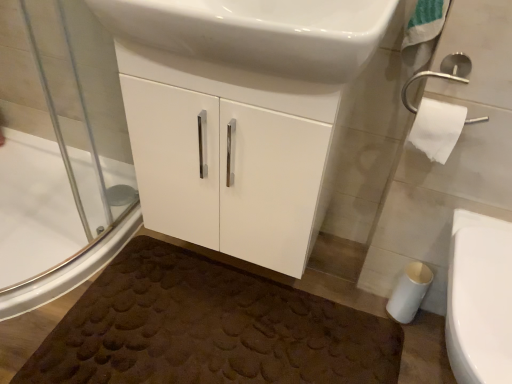
Question: Can you confirm if white glossy bidet at lower right is wider than white glossy sink at upper center?

Choices:
 (A) no
 (B) yes

Answer: (B)

Question: Can you confirm if white glossy bidet at lower right is shorter than white glossy sink at upper center?

Choices:
 (A) yes
 (B) no

Answer: (B)

Question: Is white glossy bidet at lower right facing away from white glossy sink at upper center?

Choices:
 (A) yes
 (B) no

Answer: (B)

Question: Is white glossy bidet at lower right surrounding white glossy sink at upper center?

Choices:
 (A) yes
 (B) no

Answer: (B)

Question: Can you confirm if white glossy bidet at lower right is positioned to the left of white glossy sink at upper center?

Choices:
 (A) yes
 (B) no

Answer: (B)

Question: Based on their positions, is white glossy sink at upper center located to the left or right of white glossy cabinet at center?

Choices:
 (A) right
 (B) left

Answer: (A)

Question: Considering the positions of white glossy sink at upper center and white glossy cabinet at center in the image, is white glossy sink at upper center taller or shorter than white glossy cabinet at center?

Choices:
 (A) short
 (B) tall

Answer: (A)

Question: Do you think white glossy sink at upper center is within white glossy cabinet at center, or outside of it?

Choices:
 (A) outside
 (B) inside

Answer: (A)

Question: Considering their positions, is white glossy sink at upper center located in front of or behind white glossy cabinet at center?

Choices:
 (A) behind
 (B) front

Answer: (B)

Question: Considering the positions of point pos(398,307) and point pos(389,342), is point pos(398,307) closer or farther from the camera than point pos(389,342)?

Choices:
 (A) farther
 (B) closer

Answer: (A)

Question: Looking at their shapes, would you say white matte toilet paper at lower right, the 2th toilet paper in the top-to-bottom sequence, is wider or thinner than brown textured bath mat at lower center?

Choices:
 (A) thin
 (B) wide

Answer: (A)

Question: Is white matte toilet paper at lower right, which is counted as the first toilet paper, starting from the back, in front of or behind brown textured bath mat at lower center in the image?

Choices:
 (A) front
 (B) behind

Answer: (B)

Question: From the image's perspective, is white matte toilet paper at lower right, arranged as the 2th toilet paper when viewed from the front, above or below brown textured bath mat at lower center?

Choices:
 (A) above
 (B) below

Answer: (A)

Question: From their relative heights in the image, would you say white glossy sink at upper center is taller or shorter than white matte toilet paper at lower right, arranged as the 1th toilet paper when ordered from the bottom?

Choices:
 (A) short
 (B) tall

Answer: (B)

Question: From a real-world perspective, is white glossy sink at upper center above or below white matte toilet paper at lower right, the 2th toilet paper in the top-to-bottom sequence?

Choices:
 (A) above
 (B) below

Answer: (A)